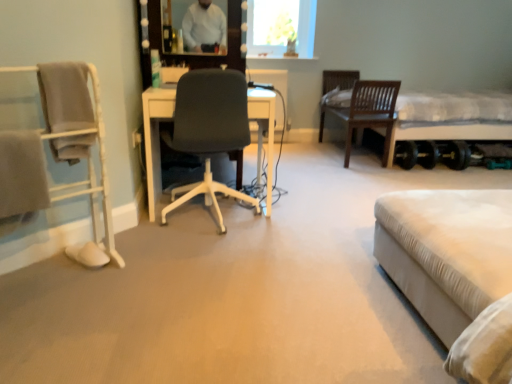
What are the coordinates of `free location to the right of black fabric chair at center, which is counted as the 2th chair, starting from the back` in the screenshot? It's located at click(x=301, y=228).